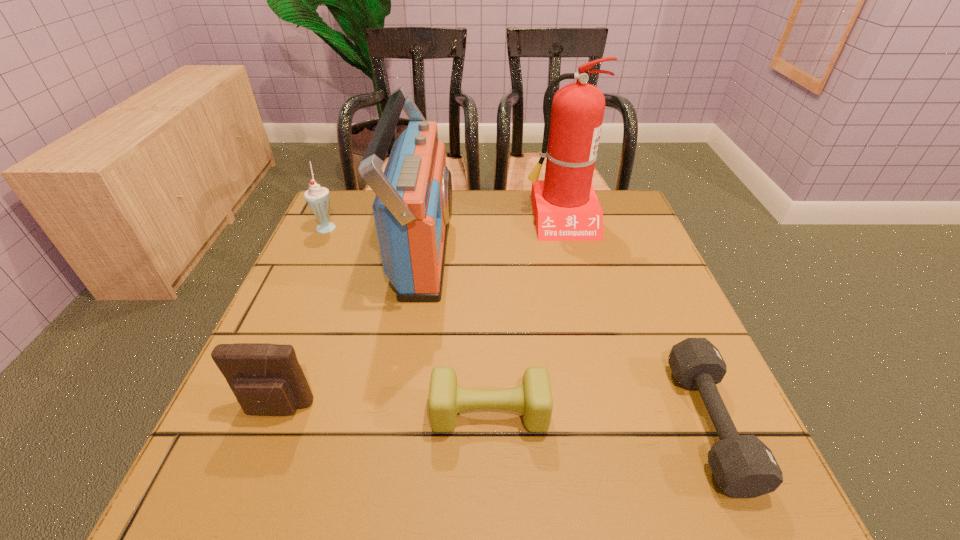
This screenshot has width=960, height=540. Identify the location of free space at the far right corner of the desktop. (598, 200).

At what (x,y) coordinates should I click in order to perform the action: click on blank region between the third shortest object and the milkshake. Please return your answer as a coordinate pair (x, y). The height and width of the screenshot is (540, 960). Looking at the image, I should click on (301, 318).

Identify the location of free space that is in between the tallest object and the radio receiver. This screenshot has width=960, height=540. click(x=492, y=234).

Where is `free space between the pouch and the milkshake`? Image resolution: width=960 pixels, height=540 pixels. free space between the pouch and the milkshake is located at coordinates (301, 318).

The image size is (960, 540). Find the location of `vacant space in between the pouch and the right dumbbell`. vacant space in between the pouch and the right dumbbell is located at coordinates (493, 416).

Where is `blank region between the left dumbbell and the fifth shortest object`? blank region between the left dumbbell and the fifth shortest object is located at coordinates (457, 332).

You are a GUI agent. You are given a task and a screenshot of the screen. Output one action in this format:
    pyautogui.click(x=<x>, y=<y>)
    Task: Click on the vacant space in between the pouch and the radio receiver
    The height and width of the screenshot is (540, 960).
    Given the screenshot: What is the action you would take?
    coord(350,330)

You are a GUI agent. You are given a task and a screenshot of the screen. Output one action in this format:
    pyautogui.click(x=<x>, y=<y>)
    Task: Click on the unoccupied position between the milkshake and the left dumbbell
    
    Given the screenshot: What is the action you would take?
    pyautogui.click(x=408, y=320)

Locate an element on the screen. vacant area that lies between the fifth object from left to right and the pouch is located at coordinates (419, 313).

Locate which object is the closest to the second object from right to left. Please provide its 2D coordinates. Your answer should be formatted as a tuple, i.e. [(x, y)], where the tuple contains the x and y coordinates of a point satisfying the conditions above.

[(413, 205)]